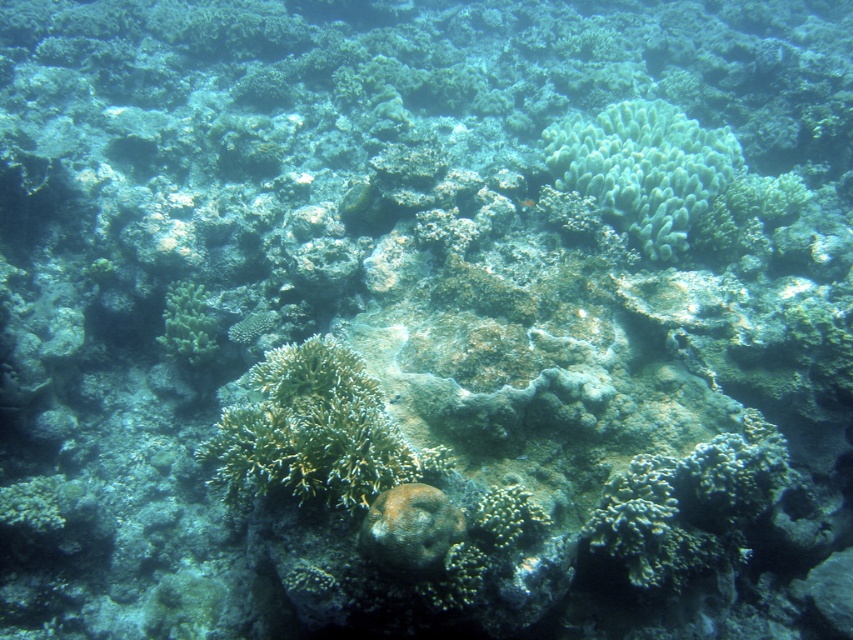
Between point (654, 189) and point (519, 204), which one is positioned in front?

Point (519, 204) is more forward.

Based on the photo, does green soft coral at upper center come behind shiny orange fish at center?

Yes, it is behind shiny orange fish at center.

This screenshot has height=640, width=853. Identify the location of green soft coral at upper center. (643, 168).

Which is above, green textured coral at center or shiny orange fish at center?

Positioned higher is shiny orange fish at center.

Which is more to the right, green textured coral at center or shiny orange fish at center?

From the viewer's perspective, shiny orange fish at center appears more on the right side.

Between point (347, 413) and point (527, 204), which one is positioned in front?

Positioned in front is point (347, 413).

Identify the location of green textured coral at center. (315, 433).

Which is above, green soft coral at upper center or green matte coral at lower left?

Positioned higher is green soft coral at upper center.

Can you confirm if green soft coral at upper center is positioned above green matte coral at lower left?

Yes, green soft coral at upper center is above green matte coral at lower left.

Between point (590, 145) and point (177, 339), which one is positioned behind?

Positioned behind is point (590, 145).

This screenshot has height=640, width=853. I want to click on green soft coral at upper center, so click(643, 168).